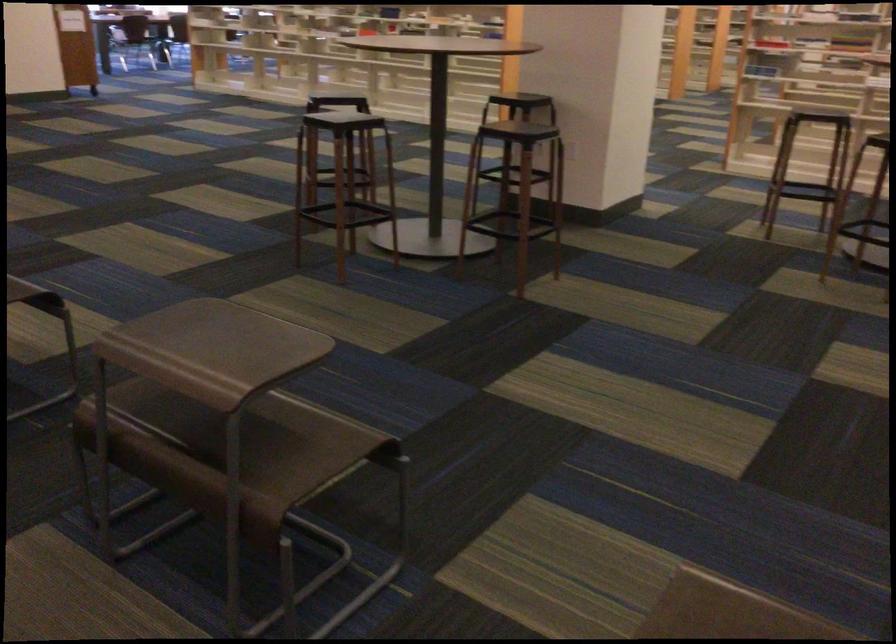
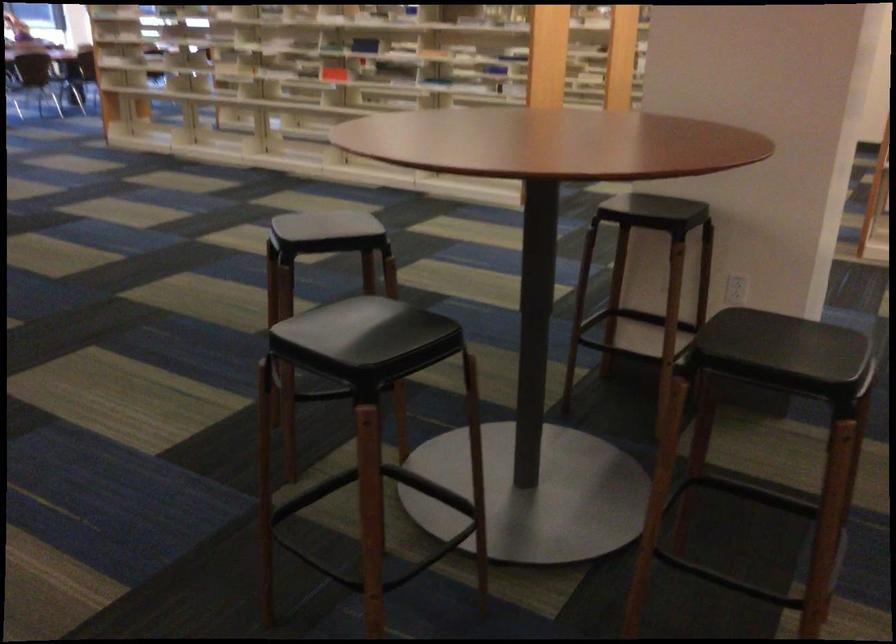
Question: Which direction would the cameraman need to move to produce the second image? Reply with the corresponding letter.

Choices:
 (A) Left
 (B) Right
 (C) Forward
 (D) Backward

Answer: (C)